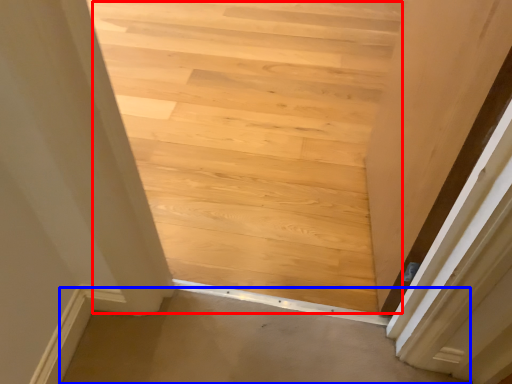
Question: Which point is closer to the camera, stairwell (highlighted by a red box) or plain (highlighted by a blue box)?

Choices:
 (A) stairwell
 (B) plain

Answer: (B)